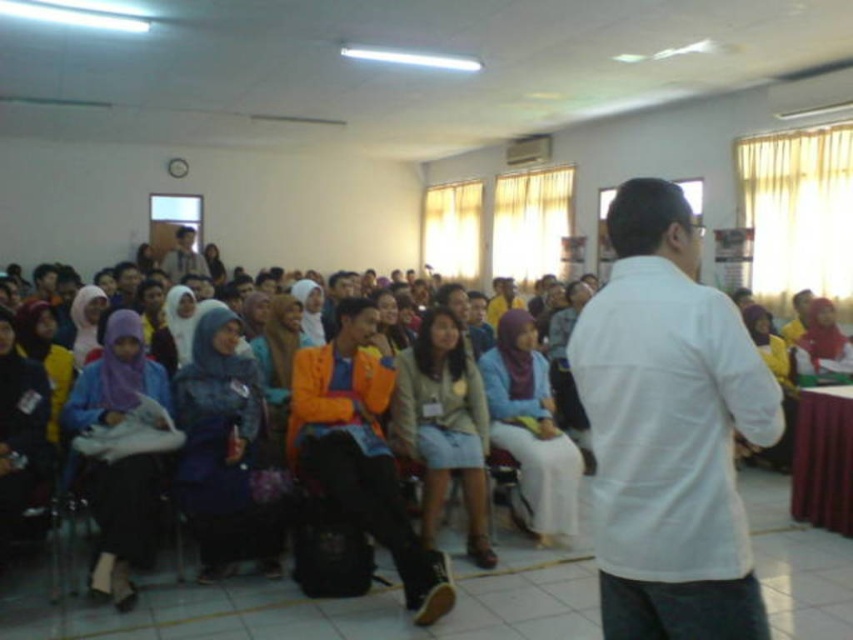
Who is shorter, white matte shirt at center or orange fabric shirt at center?

With less height is orange fabric shirt at center.

Does white matte shirt at center have a greater height compared to orange fabric shirt at center?

Yes.

Does point (706, 454) come behind point (178, 243)?

No, (706, 454) is closer to viewer.

Identify the location of white matte shirt at center. (669, 429).